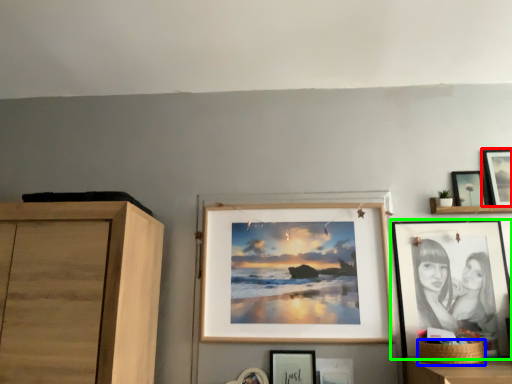
Question: Considering the real-world distances, which object is closest to picture frame (highlighted by a red box)? basket (highlighted by a blue box) or picture frame (highlighted by a green box).

Choices:
 (A) basket
 (B) picture frame

Answer: (B)